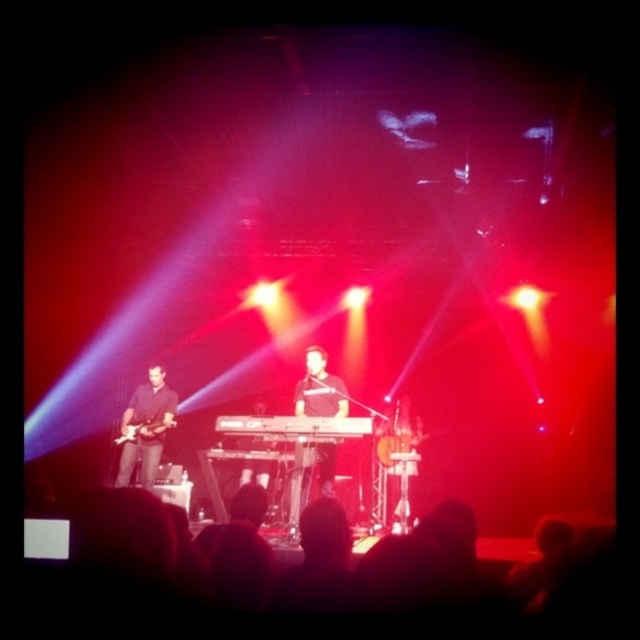
You are a stagehand who needs to position a spotlight exactly at the point marked as point (320,388). According to the scene description, what object is located at that point?

The point (320,388) indicates the location of the black matte keyboardist at center.

You are a stagehand who needs to adjust the microphone stand to ensure it reaches the singer. The microphone is currently placed at the same height as the black plastic keyboard at center. Is the microphone stand tall enough for the black matte keyboardist at center to sing comfortably?

The black matte keyboardist at center is much taller as black plastic keyboard at center, so the microphone stand needs to be raised higher than the keyboard to accommodate the keyboardist.

You are a stagehand who needs to place a 1.2 meter wide equipment case between the black matte guitar at left and the black plastic keyboard at center. Can the case fit between them?

The black matte guitar at left is narrower than the black plastic keyboard at center. However, the description only provides information about their widths relative to each other, not the actual distance between them. Without knowing the exact spacing between the two instruments, it is impossible to determine if the 1.2 meter wide equipment case can fit.